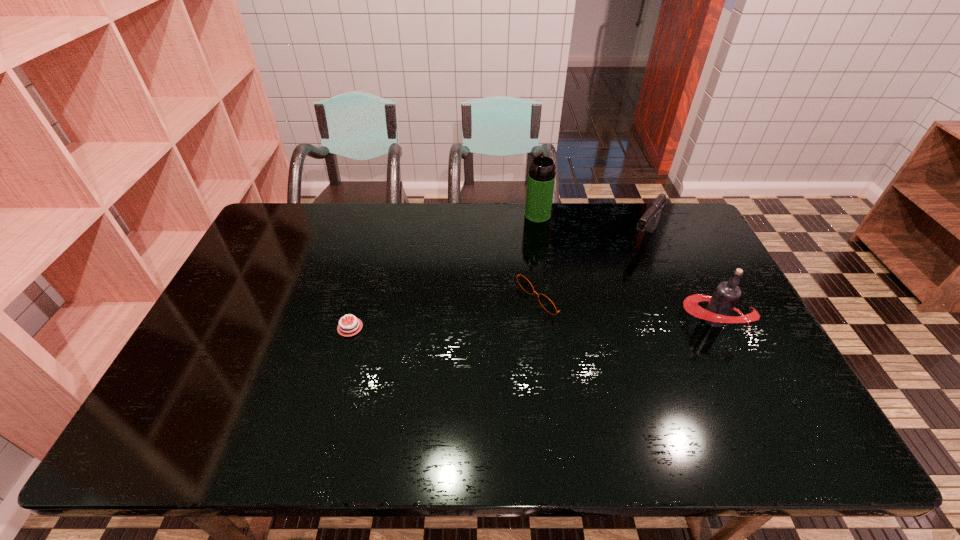
In order to click on vacant region between the fourth shortest object and the third shortest object in this screenshot , I will do `click(679, 279)`.

Where is `vacant space in between the pistol and the shortest object`? This screenshot has width=960, height=540. vacant space in between the pistol and the shortest object is located at coordinates coord(497,283).

This screenshot has height=540, width=960. I want to click on free area in between the sunglasses and the third tallest object, so click(x=598, y=265).

I want to click on vacant region between the fourth tallest object and the thermos bottle, so click(x=544, y=253).

Where is `vacant point located between the pistol and the tallest object`? This screenshot has height=540, width=960. vacant point located between the pistol and the tallest object is located at coordinates (590, 227).

Locate an element on the screen. The height and width of the screenshot is (540, 960). blank region between the third shortest object and the tallest object is located at coordinates (590, 227).

Locate an element on the screen. The image size is (960, 540). free space between the second shortest object and the third tallest object is located at coordinates point(598,265).

This screenshot has height=540, width=960. In order to click on empty space between the leftmost object and the farthest object in this screenshot , I will do `click(444, 271)`.

The height and width of the screenshot is (540, 960). In order to click on empty space between the fourth shortest object and the sunglasses in this screenshot , I will do `click(633, 306)`.

Locate an element on the screen. free space between the shortest object and the second shortest object is located at coordinates (451, 309).